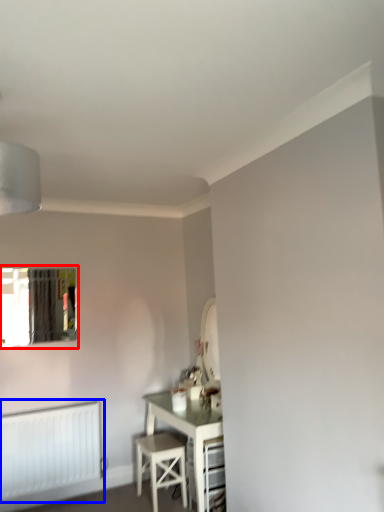
Question: Which object is further to the camera taking this photo, window (highlighted by a red box) or radiator (highlighted by a blue box)?

Choices:
 (A) window
 (B) radiator

Answer: (A)